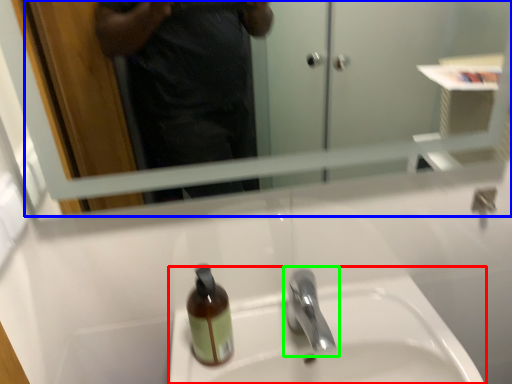
Question: Based on their relative distances, which object is farther from sink (highlighted by a red box)? Choose from mirror (highlighted by a blue box) and tap (highlighted by a green box).

Choices:
 (A) mirror
 (B) tap

Answer: (A)